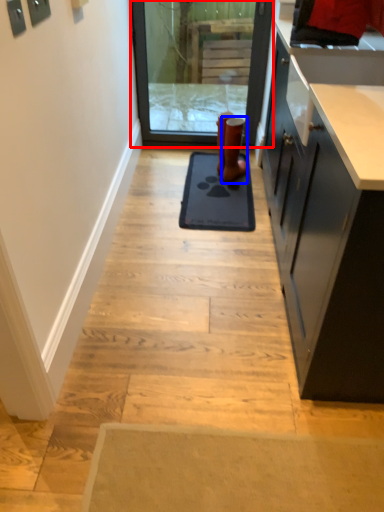
Question: Which point is further to the camera, screen door (highlighted by a red box) or footwear (highlighted by a blue box)?

Choices:
 (A) screen door
 (B) footwear

Answer: (A)